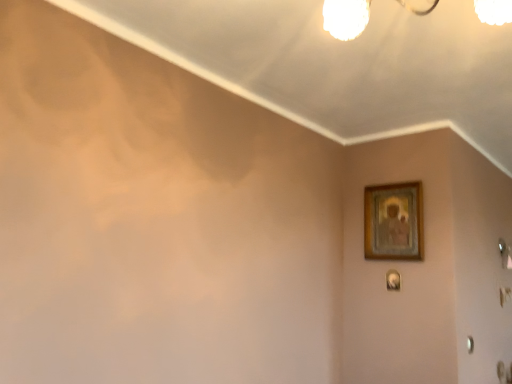
Identify the location of gold-framed painting at upper right. Image resolution: width=512 pixels, height=384 pixels. (393, 221).

Describe the element at coordinates (393, 221) in the screenshot. I see `gold-framed painting at upper right` at that location.

Find the location of a particular element. The height and width of the screenshot is (384, 512). gold-framed painting at upper right is located at coordinates (393, 221).